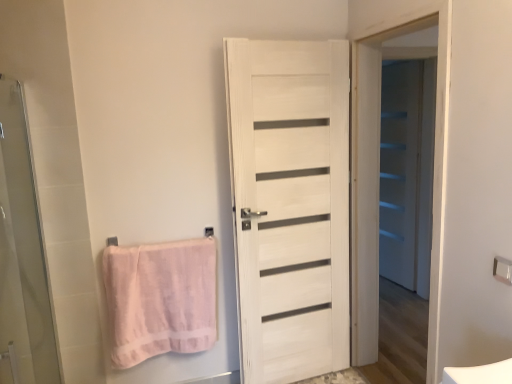
Question: Is the position of pink fabric towel bar at lower left, which appears as the second towel bar when viewed from the right, less distant than that of white wooden door at center, marked as the second screen door in a front-to-back arrangement?

Choices:
 (A) yes
 (B) no

Answer: (B)

Question: From the image's perspective, is pink fabric towel bar at lower left, which appears as the 1th towel bar when viewed from the left, under white wooden door at center, placed as the 2th screen door when sorted from back to front?

Choices:
 (A) yes
 (B) no

Answer: (A)

Question: Is pink fabric towel bar at lower left, arranged as the 2th towel bar when viewed from the front, not near white wooden door at center, placed as the 2th screen door when sorted from back to front?

Choices:
 (A) yes
 (B) no

Answer: (A)

Question: From a real-world perspective, is pink fabric towel bar at lower left, which appears as the second towel bar when viewed from the right, located beneath white wooden door at center, which is the 2th screen door in right-to-left order?

Choices:
 (A) no
 (B) yes

Answer: (B)

Question: From a real-world perspective, is pink fabric towel bar at lower left, arranged as the 2th towel bar when viewed from the front, physically above white wooden door at center, the second screen door when ordered from left to right?

Choices:
 (A) yes
 (B) no

Answer: (B)

Question: Can you confirm if pink fabric towel bar at lower left, which appears as the second towel bar when viewed from the right, is thinner than white wooden door at center, placed as the 2th screen door when sorted from back to front?

Choices:
 (A) no
 (B) yes

Answer: (B)

Question: Would you say white wood door at center is outside pink cotton towel at left?

Choices:
 (A) yes
 (B) no

Answer: (A)

Question: Is white wood door at center bigger than pink cotton towel at left?

Choices:
 (A) no
 (B) yes

Answer: (B)

Question: Is white wood door at center aimed at pink cotton towel at left?

Choices:
 (A) no
 (B) yes

Answer: (A)

Question: Is white wood door at center turned away from pink cotton towel at left?

Choices:
 (A) yes
 (B) no

Answer: (B)

Question: Is the position of white wood door at center more distant than that of pink cotton towel at left?

Choices:
 (A) yes
 (B) no

Answer: (B)

Question: Does white wood door at center have a greater width compared to pink cotton towel at left?

Choices:
 (A) no
 (B) yes

Answer: (B)

Question: Would you say metallic silver towel bar at upper right, which is counted as the second towel bar, starting from the back, is part of white wood door at center's contents?

Choices:
 (A) no
 (B) yes

Answer: (A)